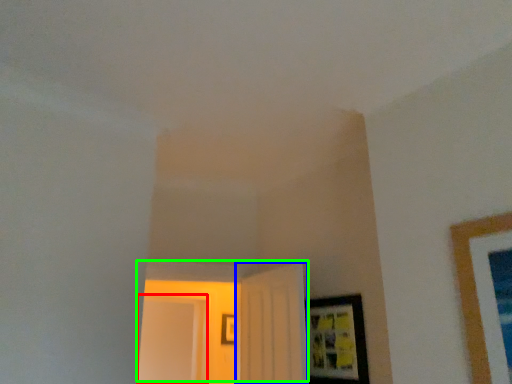
Question: Based on their relative distances, which object is nearer to glass door (highlighted by a red box)? Choose from door (highlighted by a blue box) and door (highlighted by a green box).

Choices:
 (A) door
 (B) door

Answer: (B)